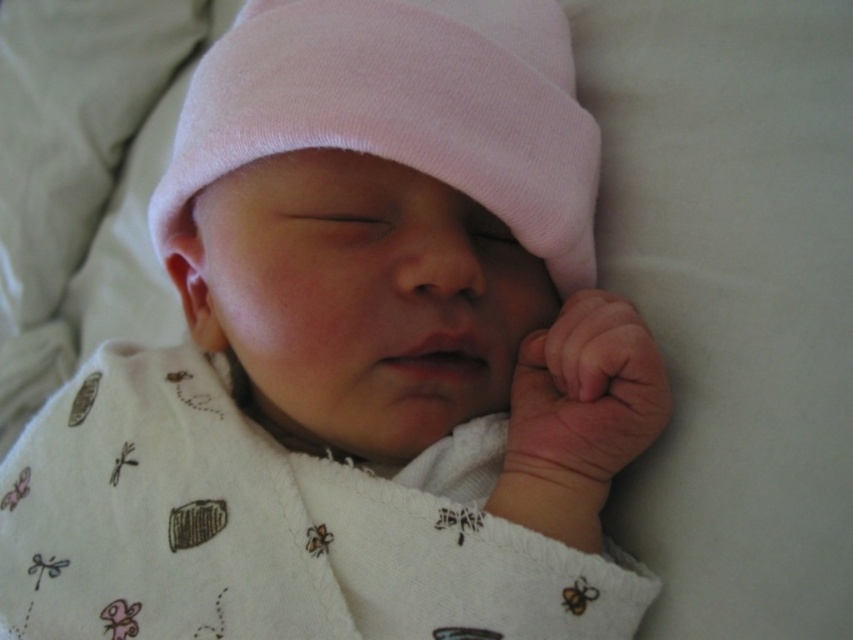
In the scene shown: You are a photographer taking a portrait of the baby. The baby is wearing a pink cotton hat at center. To ensure the hat is centered in the frame, where should you position the camera? Please provide coordinates in the format of point coordinates.

The pink cotton hat at center is positioned at point coordinates of [403,109], so you should center the camera at those coordinates to ensure the hat is centered in the frame.

Consider the image. You are a photographer taking a close up of a sleeping baby. You notice two points on the image, one at point [190,180] and the other at point [558,371]. If you want to focus on the point closer to the camera, which coordinate should you choose?

Point [190,180] is further to the camera than point [558,371], so you should choose point [190,180] to focus on the point closer to the camera.

You are a nurse checking on a baby. You need to place the smooth skin hand at lower right under the pink cotton hat at center. Will the hat cover the hand completely?

The pink cotton hat at center has a larger width than the smooth skin hand at lower right, so the hat can cover the hand completely when placed over it.